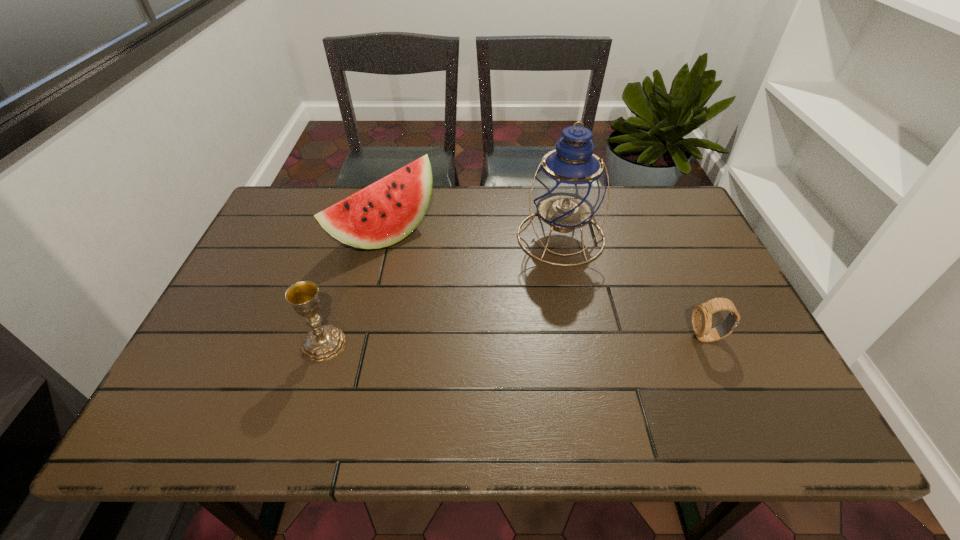
Identify the location of vacant position in the image that satisfies the following two spatial constraints: 1. on the back side of the second object from right to left; 2. on the right side of the chalice. The height and width of the screenshot is (540, 960). (357, 237).

Identify the location of vacant area that satisfies the following two spatial constraints: 1. on the back side of the chalice; 2. on the right side of the watermelon. (357, 234).